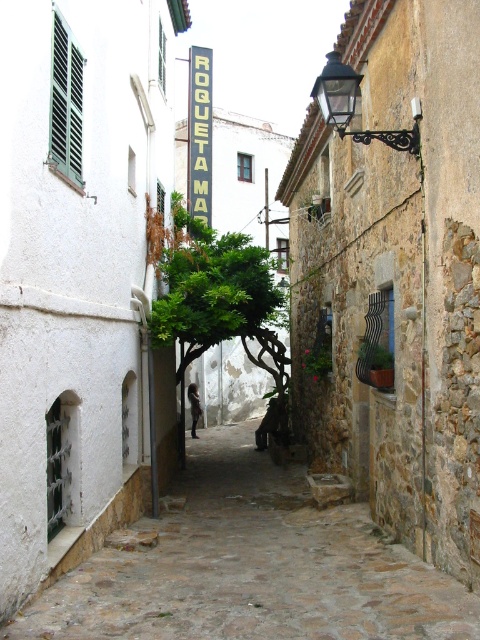
Does point (423, 588) lie behind point (194, 76)?

No, it is in front of (194, 76).

Where is `stone paved path at center`? Image resolution: width=480 pixels, height=640 pixels. stone paved path at center is located at coordinates (250, 566).

Based on the photo, who is positioned more to the left, stone paved path at center or green leafy tree at center?

Positioned to the left is green leafy tree at center.

From the picture: Can you confirm if stone paved path at center is taller than green leafy tree at center?

In fact, stone paved path at center may be shorter than green leafy tree at center.

Image resolution: width=480 pixels, height=640 pixels. What do you see at coordinates (250, 566) in the screenshot?
I see `stone paved path at center` at bounding box center [250, 566].

Where is `stone paved path at center`? stone paved path at center is located at coordinates (250, 566).

Is green leafy tree at center wider than black plastic sign at upper center?

Yes.

Image resolution: width=480 pixels, height=640 pixels. I want to click on green leafy tree at center, so click(x=213, y=291).